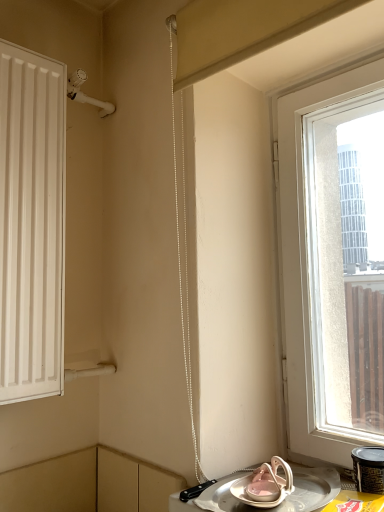
Question: Is metallic silver tray at lower right positioned in front of black plastic container at lower right?

Choices:
 (A) yes
 (B) no

Answer: (A)

Question: Is metallic silver tray at lower right facing towards black plastic container at lower right?

Choices:
 (A) yes
 (B) no

Answer: (B)

Question: Is metallic silver tray at lower right to the left of black plastic container at lower right from the viewer's perspective?

Choices:
 (A) yes
 (B) no

Answer: (A)

Question: Can you confirm if metallic silver tray at lower right is wider than black plastic container at lower right?

Choices:
 (A) yes
 (B) no

Answer: (A)

Question: Is metallic silver tray at lower right positioned behind black plastic container at lower right?

Choices:
 (A) yes
 (B) no

Answer: (B)

Question: From the image's perspective, is metallic silver tray at lower right under black plastic container at lower right?

Choices:
 (A) yes
 (B) no

Answer: (A)

Question: Can you confirm if black plastic container at lower right is smaller than metallic silver tray at lower right?

Choices:
 (A) no
 (B) yes

Answer: (B)

Question: From the image's perspective, is black plastic container at lower right over metallic silver tray at lower right?

Choices:
 (A) yes
 (B) no

Answer: (A)

Question: Does black plastic container at lower right lie in front of metallic silver tray at lower right?

Choices:
 (A) yes
 (B) no

Answer: (B)

Question: Does black plastic container at lower right come behind metallic silver tray at lower right?

Choices:
 (A) yes
 (B) no

Answer: (A)

Question: Is black plastic container at lower right taller than metallic silver tray at lower right?

Choices:
 (A) no
 (B) yes

Answer: (B)

Question: Can you confirm if black plastic container at lower right is positioned to the right of metallic silver tray at lower right?

Choices:
 (A) no
 (B) yes

Answer: (B)

Question: Considering the relative sizes of transparent glass window at right and black plastic container at lower right in the image provided, is transparent glass window at right bigger than black plastic container at lower right?

Choices:
 (A) yes
 (B) no

Answer: (A)